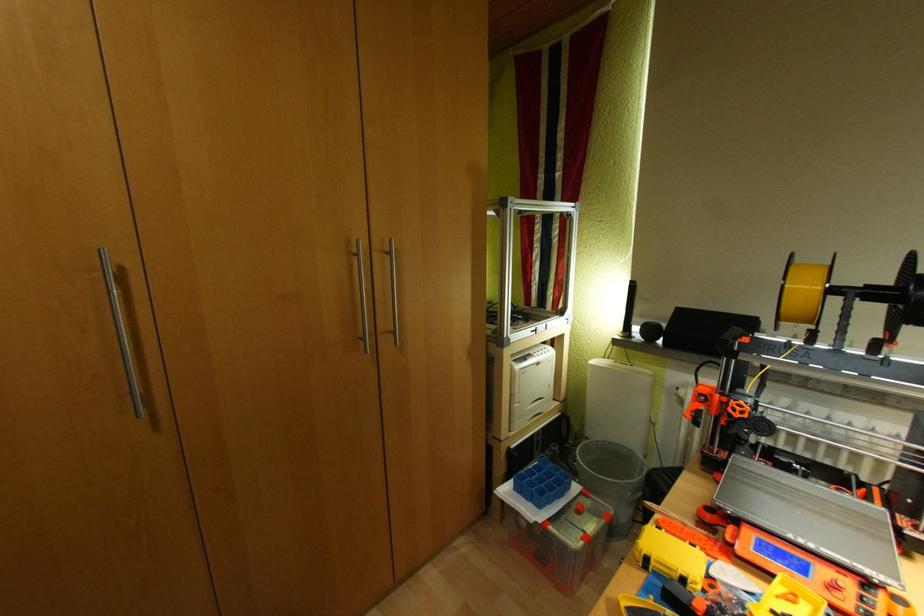
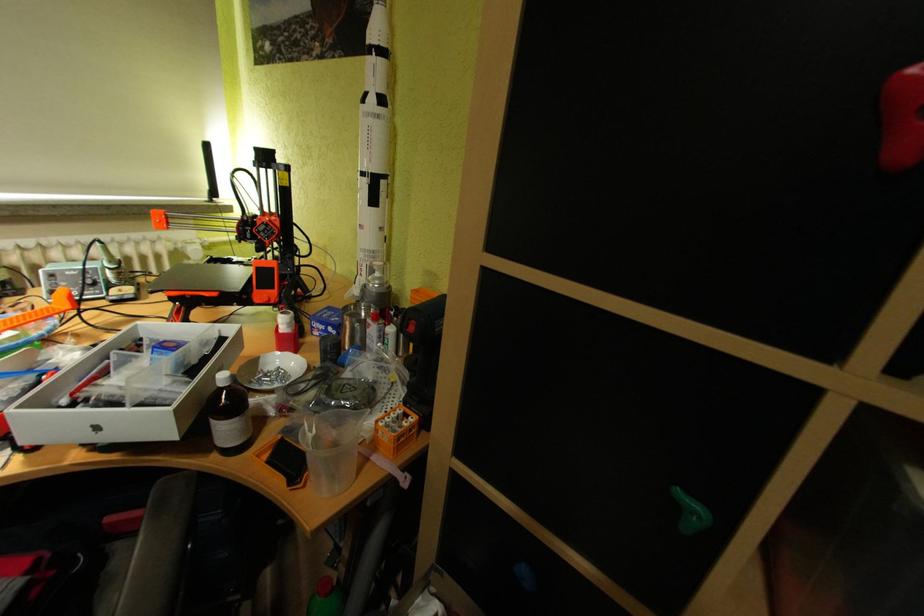
The first image is from the beginning of the video and the second image is from the end. How did the camera likely rotate when shooting the video?

The camera's rotation is toward right-down.